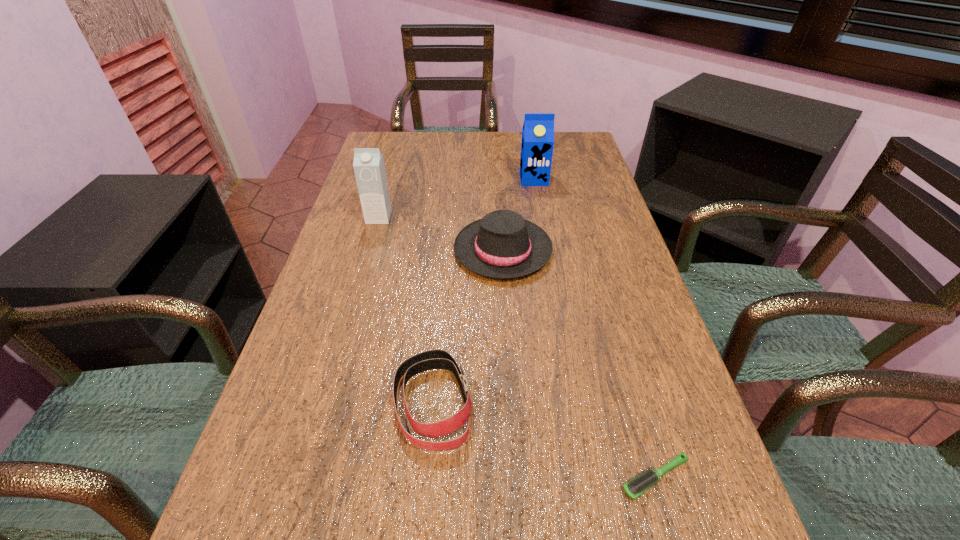
The image size is (960, 540). In order to click on the right carton in this screenshot , I will do `click(537, 143)`.

The image size is (960, 540). Find the location of `the farthest object`. the farthest object is located at coordinates (537, 143).

What are the coordinates of `the leftmost object` in the screenshot? It's located at click(x=369, y=167).

Find the location of `the left carton`. the left carton is located at coordinates (369, 167).

Locate an element on the screen. Image resolution: width=960 pixels, height=540 pixels. dress hat is located at coordinates (503, 245).

Find the location of a particular element. This screenshot has height=540, width=960. dog collar is located at coordinates (433, 359).

This screenshot has width=960, height=540. I want to click on the fourth farthest object, so click(x=433, y=359).

Identify the location of the nearest object. The width and height of the screenshot is (960, 540). (635, 487).

Image resolution: width=960 pixels, height=540 pixels. I want to click on the rightmost object, so click(x=635, y=487).

I want to click on free space located 0.220m with the cap open on the right carton, so click(x=542, y=230).